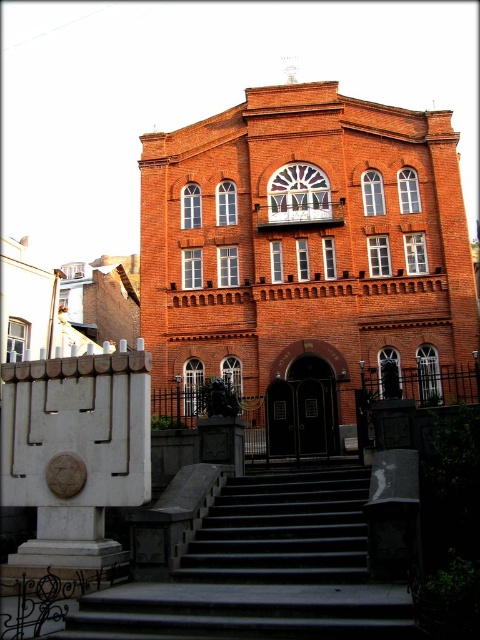
You are standing in front of a red brick synagogue with arched windows and a central doorway. You notice a point marked at coordinate (405, 349). Given that this point is 62.53 meters away from you, can you estimate how far you are from the entrance of the synagogue?

The point at coordinate (405, 349) is 62.53 meters away from the camera. Since the entrance is part of the building and the point is likely located near the entrance area, you are approximately 62.53 meters away from the entrance of the synagogue.

You are standing at the point marked as point (x=305, y=259). What is the building directly in front of you?

The building directly in front of you at point (x=305, y=259) is the red brick church at center.

You are standing at the bottom of the black stone stairs at center, looking up towards the red brick church at center. Which structure appears taller from your perspective?

The red brick church at center appears taller than the black stone stairs at center from your perspective because it has a greater height compared to the stairs.